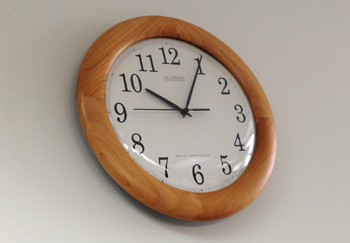
I want to click on wall, so click(311, 149).